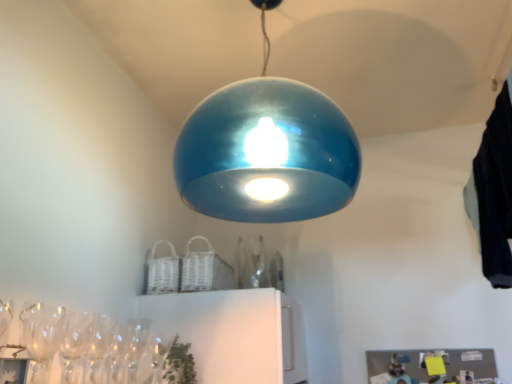
Question: From a real-world perspective, is glossy blue dome at center located higher than clear glass wine glass at lower left?

Choices:
 (A) yes
 (B) no

Answer: (A)

Question: Does glossy blue dome at center have a greater height compared to clear glass wine glass at lower left?

Choices:
 (A) no
 (B) yes

Answer: (B)

Question: Is clear glass wine glass at lower left surrounded by glossy blue dome at center?

Choices:
 (A) no
 (B) yes

Answer: (A)

Question: Is glossy blue dome at center further to the viewer compared to clear glass wine glass at lower left?

Choices:
 (A) no
 (B) yes

Answer: (A)

Question: Are glossy blue dome at center and clear glass wine glass at lower left located far from each other?

Choices:
 (A) yes
 (B) no

Answer: (B)

Question: Is glossy blue dome at center inside the boundaries of clear glass wine glass at lower left, or outside?

Choices:
 (A) inside
 (B) outside

Answer: (B)

Question: In terms of height, does glossy blue dome at center look taller or shorter compared to clear glass wine glass at lower left?

Choices:
 (A) tall
 (B) short

Answer: (A)

Question: Is glossy blue dome at center in front of or behind clear glass wine glass at lower left in the image?

Choices:
 (A) behind
 (B) front

Answer: (B)

Question: From a real-world perspective, is glossy blue dome at center physically located above or below clear glass wine glass at lower left?

Choices:
 (A) above
 (B) below

Answer: (A)

Question: Is clear glass wine glass at lower left inside or outside of dark blue fabric at upper right?

Choices:
 (A) inside
 (B) outside

Answer: (B)

Question: Is point (135, 379) closer or farther from the camera than point (499, 279)?

Choices:
 (A) closer
 (B) farther

Answer: (A)

Question: From the image's perspective, is clear glass wine glass at lower left above or below dark blue fabric at upper right?

Choices:
 (A) above
 (B) below

Answer: (B)

Question: Is clear glass wine glass at lower left to the left or to the right of dark blue fabric at upper right in the image?

Choices:
 (A) left
 (B) right

Answer: (A)

Question: Is dark blue fabric at upper right spatially inside clear glass wine glass at lower left, or outside of it?

Choices:
 (A) inside
 (B) outside

Answer: (B)

Question: From their relative heights in the image, would you say dark blue fabric at upper right is taller or shorter than clear glass wine glass at lower left?

Choices:
 (A) tall
 (B) short

Answer: (A)